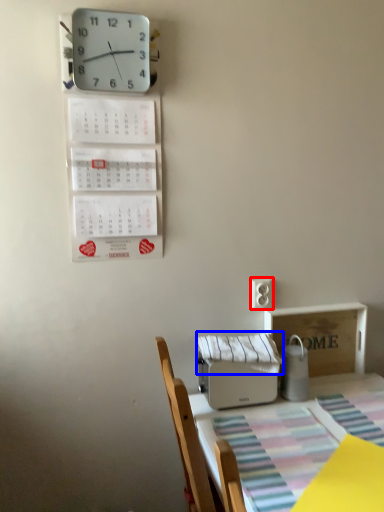
Question: Among these objects, which one is farthest to the camera, electric outlet (highlighted by a red box) or blanket (highlighted by a blue box)?

Choices:
 (A) electric outlet
 (B) blanket

Answer: (A)